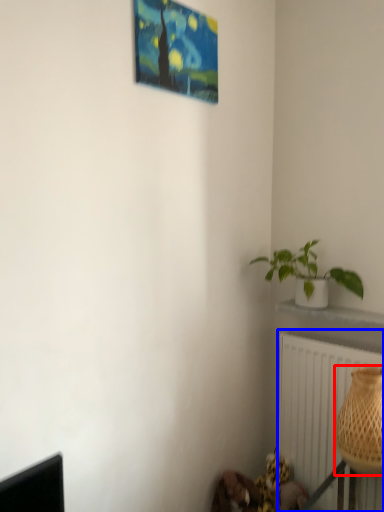
Question: Which object appears closest to the camera in this image, basket (highlighted by a red box) or radiator (highlighted by a blue box)?

Choices:
 (A) basket
 (B) radiator

Answer: (A)